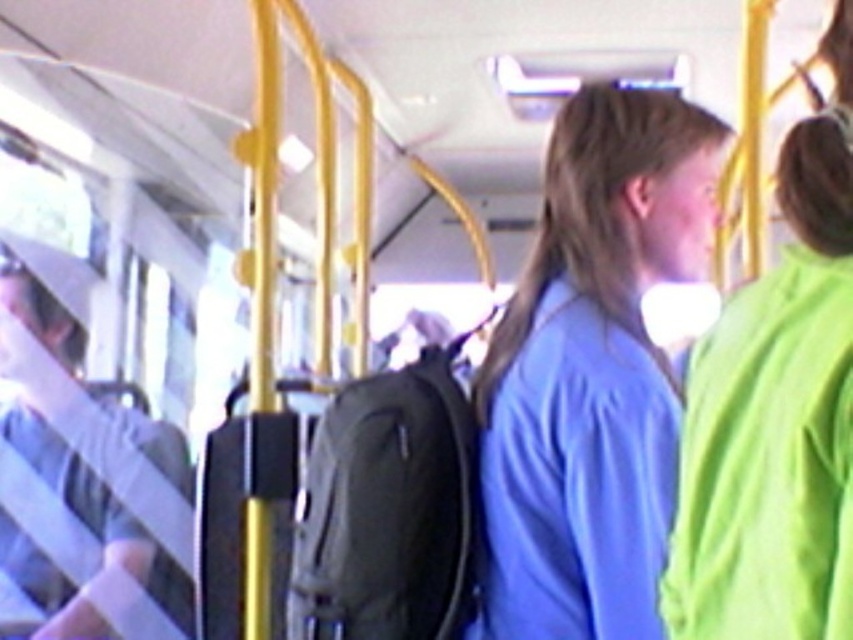
You are a passenger on a moving bus and need to determine which of the two blue shirts is taller. You see a blue matte shirt at center and a blue fabric shirt at center. Which one is taller?

The blue matte shirt at center is taller than the blue fabric shirt at center according to the description.

You are a passenger on a moving bus and need to decide which shirt to wear for better visibility. Considering the two shirts available, the blue matte shirt at center and the blue fabric shirt at center, which one has a wider design?

The blue matte shirt at center has a wider design than the blue fabric shirt at center according to the description provided.

You are a passenger on a moving bus and need to decide whether to place your small water bottle between the blue matte shirt at center and the light gray fabric bag at left. Based on their sizes, will there be enough space?

The blue matte shirt at center is smaller than the light gray fabric bag at left, so there should be sufficient space between them to place your small water bottle.